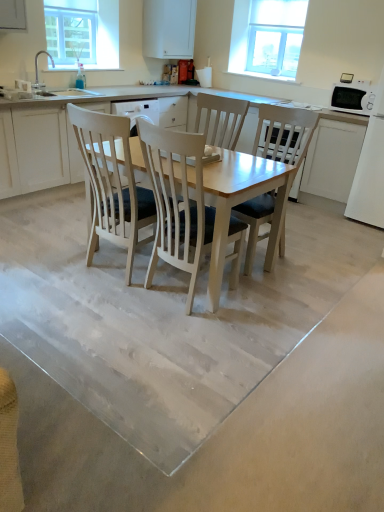
Question: Considering the relative positions of white wood chair at center, which appears as the 1th chair when viewed from the left, and clear glass window screen at upper left in the image provided, is white wood chair at center, which appears as the 1th chair when viewed from the left, to the left of clear glass window screen at upper left from the viewer's perspective?

Choices:
 (A) yes
 (B) no

Answer: (B)

Question: Is white wood chair at center, which appears as the 1th chair when viewed from the left, not close to clear glass window screen at upper left?

Choices:
 (A) yes
 (B) no

Answer: (A)

Question: Is white wood chair at center, arranged as the 2th chair when viewed from the right, positioned beyond the bounds of clear glass window screen at upper left?

Choices:
 (A) no
 (B) yes

Answer: (B)

Question: Would you say clear glass window screen at upper left is part of white wood chair at center, which appears as the 1th chair when viewed from the left,'s contents?

Choices:
 (A) no
 (B) yes

Answer: (A)

Question: Could you tell me if white wood chair at center, which appears as the 1th chair when viewed from the left, is facing clear glass window screen at upper left?

Choices:
 (A) yes
 (B) no

Answer: (B)

Question: Does white wood chair at center, arranged as the 2th chair when viewed from the right, have a greater height compared to clear glass window screen at upper left?

Choices:
 (A) no
 (B) yes

Answer: (B)

Question: Does smooth concrete floor at center have a lesser width compared to white glossy microwave at upper right?

Choices:
 (A) no
 (B) yes

Answer: (A)

Question: Is smooth concrete floor at center far from white glossy microwave at upper right?

Choices:
 (A) yes
 (B) no

Answer: (A)

Question: Is smooth concrete floor at center directly adjacent to white glossy microwave at upper right?

Choices:
 (A) yes
 (B) no

Answer: (B)

Question: Is smooth concrete floor at center positioned before white glossy microwave at upper right?

Choices:
 (A) no
 (B) yes

Answer: (B)

Question: Could white glossy microwave at upper right be considered to be inside smooth concrete floor at center?

Choices:
 (A) no
 (B) yes

Answer: (A)

Question: Does smooth concrete floor at center have a smaller size compared to white glossy microwave at upper right?

Choices:
 (A) yes
 (B) no

Answer: (B)

Question: Is the depth of clear glass window at upper right greater than that of white glossy microwave at upper right?

Choices:
 (A) no
 (B) yes

Answer: (B)